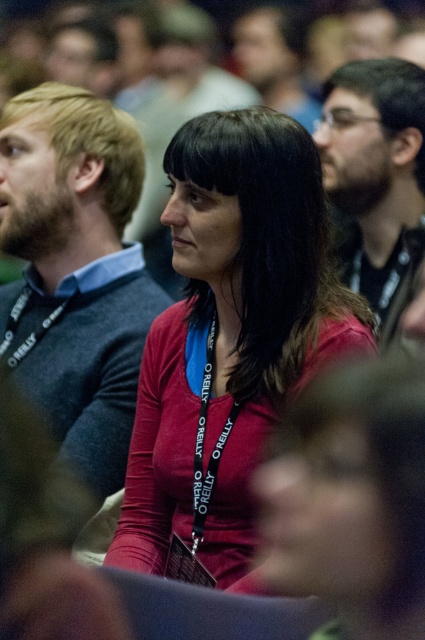
What do you see at coordinates (76, 269) in the screenshot? Image resolution: width=425 pixels, height=640 pixels. I see `matte gray sweater at left` at bounding box center [76, 269].

Does point (119, 422) lie behind point (385, 307)?

No.

Is point (122, 349) farther from camera compared to point (319, 128)?

No.

Find the location of a particular element. matte gray sweater at left is located at coordinates tap(76, 269).

Between matte red shirt at center and matte black glasses at upper right, which one is positioned lower?

Positioned lower is matte red shirt at center.

Is matte red shirt at center below matte black glasses at upper right?

Indeed, matte red shirt at center is positioned under matte black glasses at upper right.

Who is more forward, [302,138] or [374,116]?

Point [302,138] is in front.

Where is `matte red shirt at center`? Image resolution: width=425 pixels, height=640 pixels. matte red shirt at center is located at coordinates (229, 336).

Based on the photo, which is below, matte red shirt at center or matte gray sweater at left?

Positioned lower is matte red shirt at center.

Does matte red shirt at center have a larger size compared to matte gray sweater at left?

Yes.

Where is `matte red shirt at center`? The height and width of the screenshot is (640, 425). matte red shirt at center is located at coordinates (229, 336).